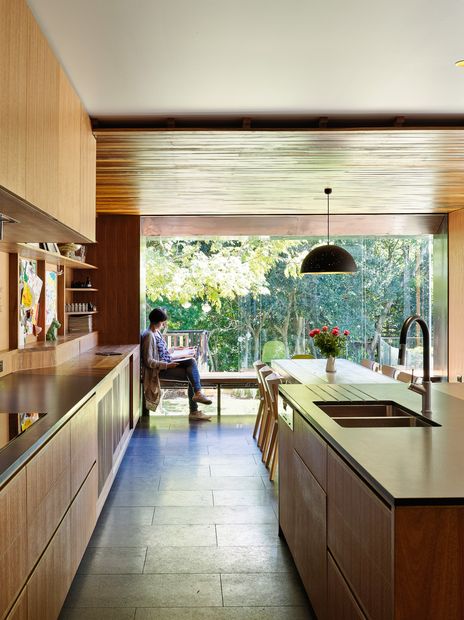
What are the coordinates of `light` in the screenshot? It's located at (316, 253).